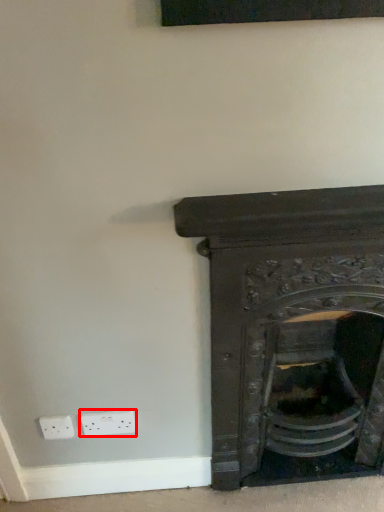
Question: In this image, where is electric outlet (annotated by the red box) located relative to fireplace?

Choices:
 (A) left
 (B) right

Answer: (A)